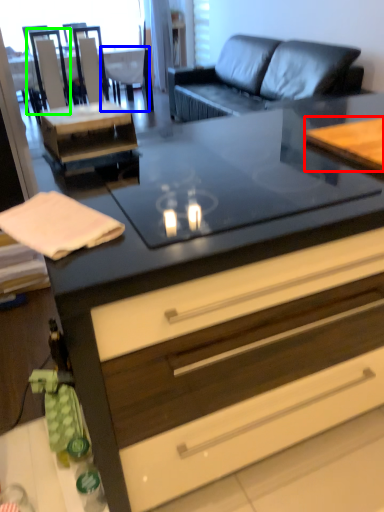
Question: Which object is positioned farthest from table (highlighted by a red box)? Select from armchair (highlighted by a blue box) and armchair (highlighted by a green box).

Choices:
 (A) armchair
 (B) armchair

Answer: (A)